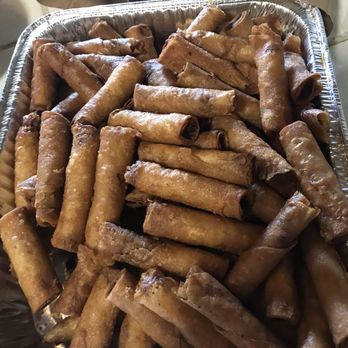
At what (x,y) coordinates should I click in order to perform the action: click on bottom of metal pan. Please return your answer as a coordinate pair (x, y). This screenshot has height=348, width=348. Looking at the image, I should click on (44, 324).